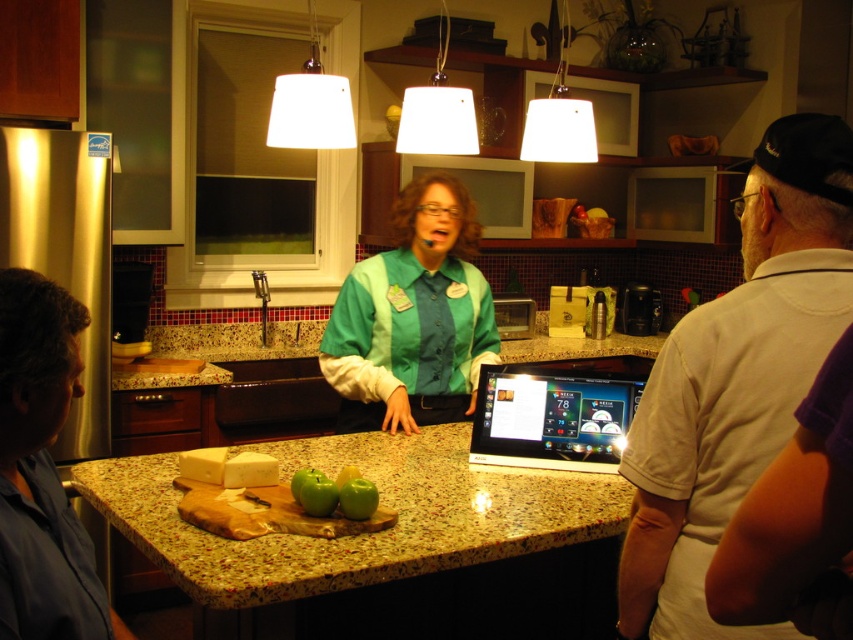
Question: Does green fabric shirt at center have a lesser width compared to black glossy tablet at center?

Choices:
 (A) yes
 (B) no

Answer: (B)

Question: Estimate the real-world distances between objects in this image. Which object is closer to the speckled granite counter at center?

Choices:
 (A) green matte apples at center
 (B) black glossy tablet at center
 (C) green fabric shirt at center

Answer: (A)

Question: Does speckled granite counter at center have a larger size compared to green fabric shirt at center?

Choices:
 (A) yes
 (B) no

Answer: (A)

Question: Estimate the real-world distances between objects in this image. Which object is closer to the green fabric shirt at center?

Choices:
 (A) green matte apples at center
 (B) white cotton shirt at right

Answer: (A)

Question: Which point is farther from the camera taking this photo?

Choices:
 (A) tap(578, 385)
 (B) tap(567, 532)
 (C) tap(785, 198)

Answer: (A)

Question: Is green fabric shirt at center positioned in front of green matte apples at center?

Choices:
 (A) no
 (B) yes

Answer: (A)